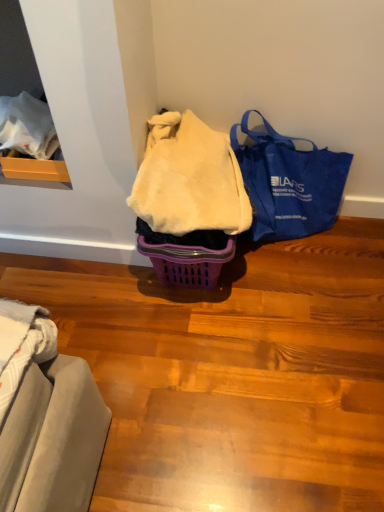
Locate an element on the screen. Image resolution: width=384 pixels, height=512 pixels. unoccupied area in front of blue canvas tote bag at right is located at coordinates (297, 297).